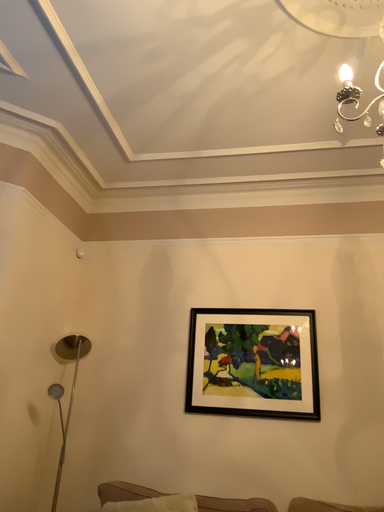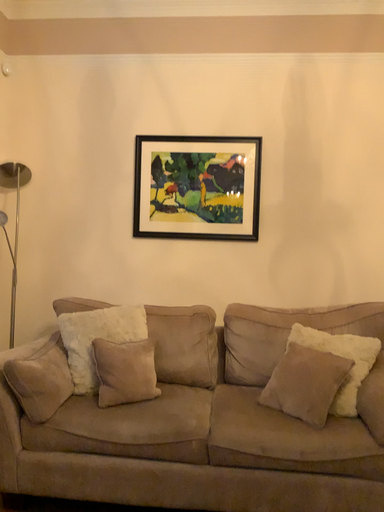
Question: How did the camera likely rotate when shooting the video?

Choices:
 (A) rotated left
 (B) rotated right

Answer: (B)